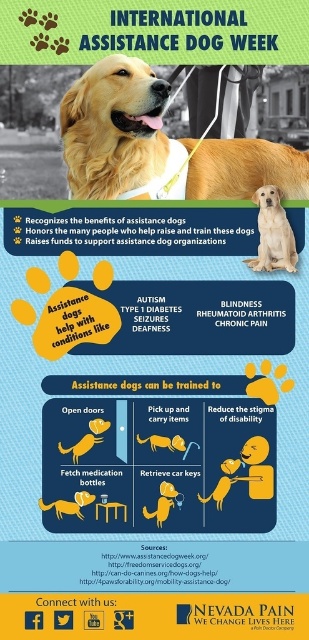
You are an animal trainer assessing the image for a training manual. You notice the golden matte fur at center and the yellow matte dog at center. Based on their spatial relationship, which one do you think has a greater width?

The golden matte fur at center might be wider than the yellow matte dog at center according to the description.

What is the relationship between the widths of the golden fur assistance dog at center and the matte yellow dog at center in the image?

The golden fur assistance dog at center is thinner than the matte yellow dog at center.

You are standing in front of the infographic and notice two points labeled as point 1 and point 2. Point 1 is at coordinate (176, 140) and point 2 is at (93, 435). Based on the description, which point is closer to you?

Point 1 at (176, 140) is closer to you because it is further to the camera than point 2 at (93, 435).